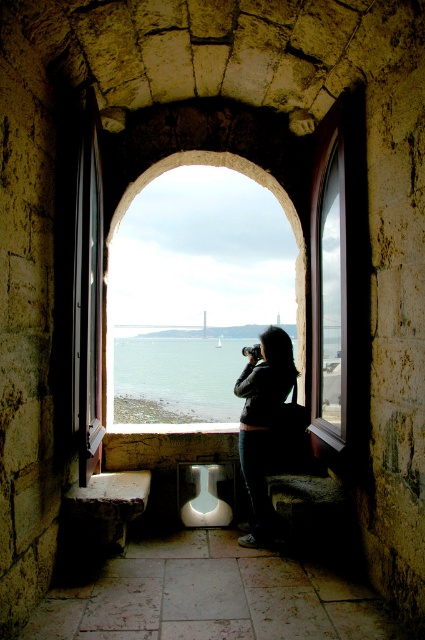
Is transparent glass window at center positioned before dark gray sweater at center?

Yes, transparent glass window at center is in front of dark gray sweater at center.

Describe the element at coordinates (295, 264) in the screenshot. I see `transparent glass window at center` at that location.

Which is behind, point (139, 148) or point (243, 413)?

Point (139, 148)

Image resolution: width=425 pixels, height=640 pixels. I want to click on transparent glass window at center, so click(x=295, y=264).